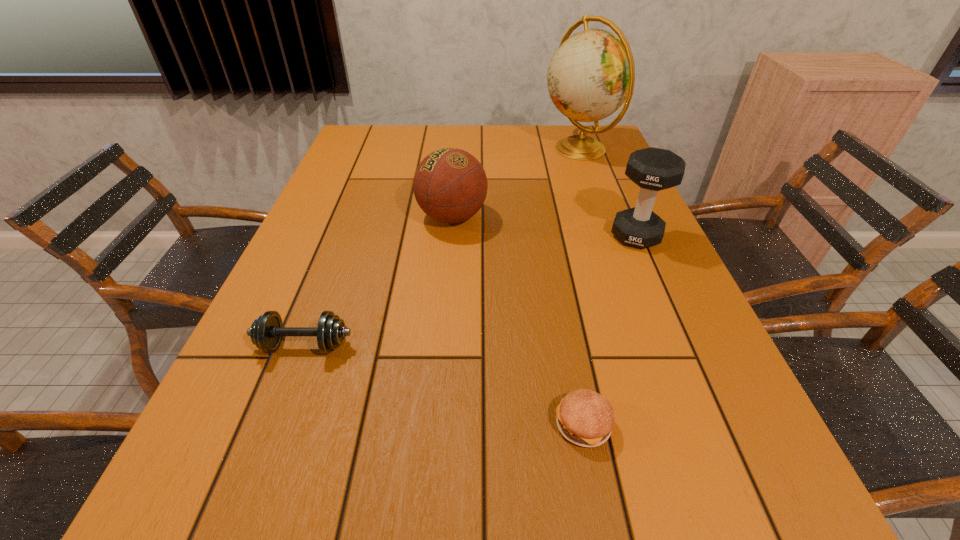
Locate an element on the screen. blank area at the near edge is located at coordinates (499, 529).

Identify the location of free location at the left edge of the desktop. (353, 161).

You are a GUI agent. You are given a task and a screenshot of the screen. Output one action in this format:
    pyautogui.click(x=<x>, y=<y>)
    Task: Click on the blank space at the right edge of the desktop
    Image resolution: width=960 pixels, height=540 pixels.
    Given the screenshot: What is the action you would take?
    click(x=638, y=263)

In the image, there is a desktop. Identify the location of vacant space at the far right corner. This screenshot has width=960, height=540. (564, 133).

Locate an element on the screen. The height and width of the screenshot is (540, 960). vacant space at the near right corner of the desktop is located at coordinates (738, 537).

The height and width of the screenshot is (540, 960). Identify the location of vacant area that lies between the taller dumbbell and the hamburger. (610, 330).

Locate an element on the screen. unoccupied area between the hamburger and the left dumbbell is located at coordinates (444, 385).

Identify the location of vacant space in between the taller dumbbell and the nearest object. (610, 330).

Image resolution: width=960 pixels, height=540 pixels. Find the location of `empty space between the nearest object and the shorter dumbbell`. empty space between the nearest object and the shorter dumbbell is located at coordinates (444, 385).

Image resolution: width=960 pixels, height=540 pixels. Find the location of `free area in between the taller dumbbell and the second nearest object`. free area in between the taller dumbbell and the second nearest object is located at coordinates (470, 291).